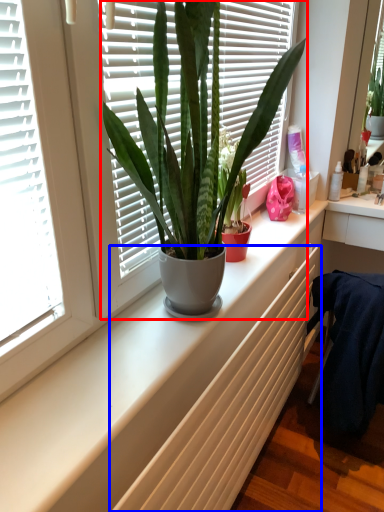
Question: Which object appears closest to the camera in this image, houseplant (highlighted by a red box) or radiator (highlighted by a blue box)?

Choices:
 (A) houseplant
 (B) radiator

Answer: (B)